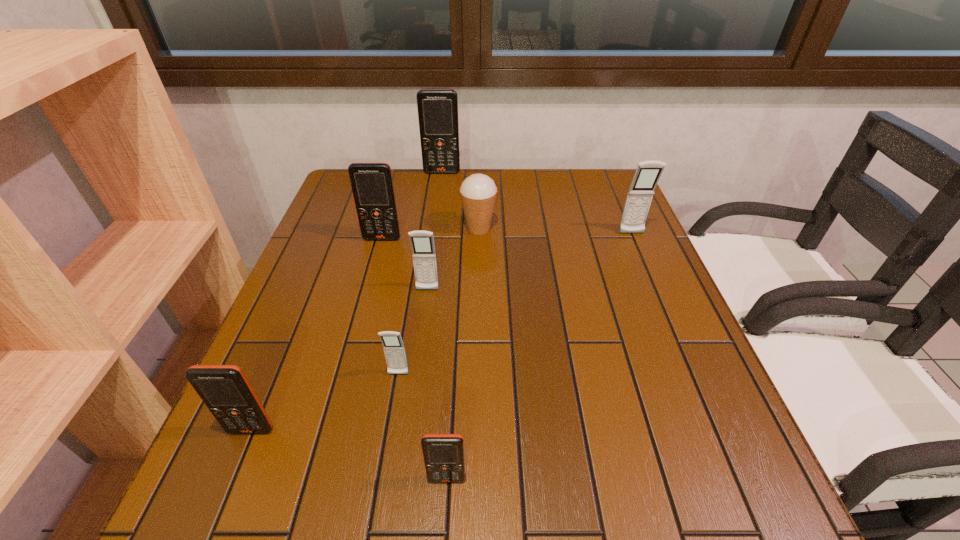
Identify the location of blank area at the far right corner. (606, 187).

Where is `free spot between the leftmost object and the biggest gray cellular telephone`? free spot between the leftmost object and the biggest gray cellular telephone is located at coordinates (442, 332).

Find the location of a particular element. free space between the icecream and the tallest cellular telephone is located at coordinates (461, 200).

At what (x,y) coordinates should I click in order to perform the action: click on empty location between the icecream and the tallest object. Please return your answer as a coordinate pair (x, y). Looking at the image, I should click on (x=461, y=200).

I want to click on vacant space that is in between the second cellular telephone from left to right and the sixth farthest cellular telephone, so click(317, 334).

Image resolution: width=960 pixels, height=540 pixels. What are the coordinates of `vacant space that is in between the third orange cellular telephone from right to left and the rightmost object` in the screenshot? It's located at (507, 236).

You are a GUI agent. You are given a task and a screenshot of the screen. Output one action in this format:
    pyautogui.click(x=<x>, y=<y>)
    Task: Click on the blank region between the third nearest cellular telephone and the fourth farthest cellular telephone
    Image resolution: width=960 pixels, height=540 pixels.
    Given the screenshot: What is the action you would take?
    pyautogui.click(x=413, y=332)

Where is `vacant region between the nearest orange cellular telephone and the nearest gray cellular telephone`? vacant region between the nearest orange cellular telephone and the nearest gray cellular telephone is located at coordinates (422, 427).

You are a GUI agent. You are given a task and a screenshot of the screen. Output one action in this format:
    pyautogui.click(x=<x>, y=<y>)
    Task: Click on the vacant area that lies between the smallest orange cellular telephone and the second object from left to right
    The image size is (960, 540).
    Given the screenshot: What is the action you would take?
    pyautogui.click(x=415, y=359)

The width and height of the screenshot is (960, 540). What are the coordinates of `object identified as the second closest to the nearest orange cellular telephone` in the screenshot? It's located at (225, 390).